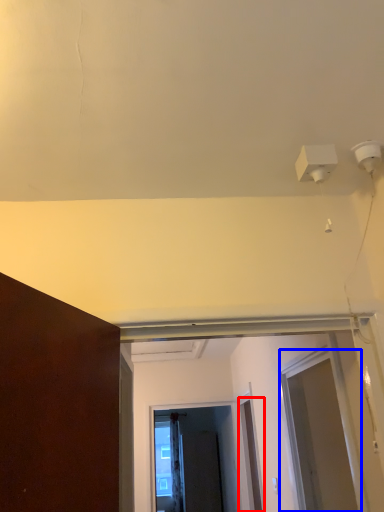
Question: Which of the following is the farthest to the observer, door (highlighted by a red box) or screen door (highlighted by a blue box)?

Choices:
 (A) door
 (B) screen door

Answer: (A)